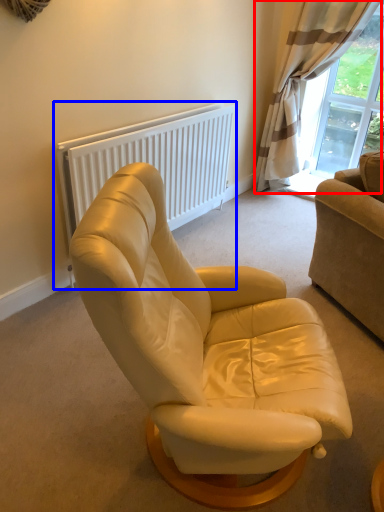
Question: Among these objects, which one is nearest to the camera, curtain (highlighted by a red box) or radiator (highlighted by a blue box)?

Choices:
 (A) curtain
 (B) radiator

Answer: (B)